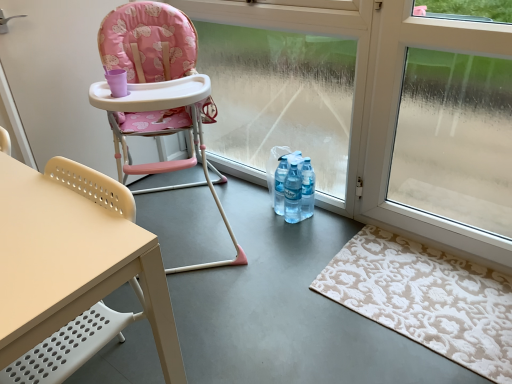
Question: Is translucent plastic bottles at center not inside beige textured rug at lower right?

Choices:
 (A) no
 (B) yes

Answer: (B)

Question: Considering the relative sizes of translucent plastic bottles at center and beige textured rug at lower right in the image provided, is translucent plastic bottles at center shorter than beige textured rug at lower right?

Choices:
 (A) no
 (B) yes

Answer: (A)

Question: Is translucent plastic bottles at center closer to camera compared to beige textured rug at lower right?

Choices:
 (A) no
 (B) yes

Answer: (A)

Question: From the image's perspective, is translucent plastic bottles at center located above beige textured rug at lower right?

Choices:
 (A) yes
 (B) no

Answer: (A)

Question: Does translucent plastic bottles at center lie behind beige textured rug at lower right?

Choices:
 (A) yes
 (B) no

Answer: (A)

Question: From the image's perspective, relative to pink fabric highchair at left, marked as the 2th chair in a front-to-back arrangement, is beige textured rug at lower right above or below?

Choices:
 (A) above
 (B) below

Answer: (B)

Question: Is beige textured rug at lower right wider or thinner than pink fabric highchair at left, the 1th chair when ordered from back to front?

Choices:
 (A) thin
 (B) wide

Answer: (A)

Question: Based on their positions, is beige textured rug at lower right located to the left or right of pink fabric highchair at left, the 1th chair when ordered from back to front?

Choices:
 (A) right
 (B) left

Answer: (A)

Question: From a real-world perspective, is beige textured rug at lower right above or below pink fabric highchair at left, the 1th chair when ordered from back to front?

Choices:
 (A) above
 (B) below

Answer: (B)

Question: Considering the relative positions of beige textured rug at lower right and transparent glass window at center in the image provided, is beige textured rug at lower right to the left or to the right of transparent glass window at center?

Choices:
 (A) right
 (B) left

Answer: (A)

Question: Is beige textured rug at lower right taller or shorter than transparent glass window at center?

Choices:
 (A) short
 (B) tall

Answer: (A)

Question: Is beige textured rug at lower right in front of or behind transparent glass window at center in the image?

Choices:
 (A) front
 (B) behind

Answer: (A)

Question: Is beige textured rug at lower right inside or outside of transparent glass window at center?

Choices:
 (A) outside
 (B) inside

Answer: (A)

Question: Is pink fabric highchair at left, marked as the 2th chair in a front-to-back arrangement, inside or outside of beige plastic chair at left, marked as the 1th chair in a front-to-back arrangement?

Choices:
 (A) inside
 (B) outside

Answer: (B)

Question: Is pink fabric highchair at left, marked as the 2th chair in a front-to-back arrangement, wider or thinner than beige plastic chair at left, marked as the 1th chair in a front-to-back arrangement?

Choices:
 (A) wide
 (B) thin

Answer: (A)